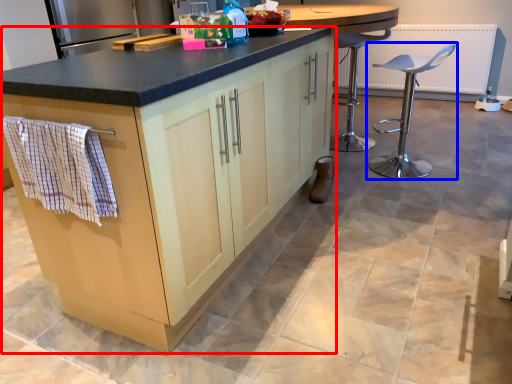
Question: Which of the following is the farthest to the observer, cabinetry (highlighted by a red box) or chair (highlighted by a blue box)?

Choices:
 (A) cabinetry
 (B) chair

Answer: (B)